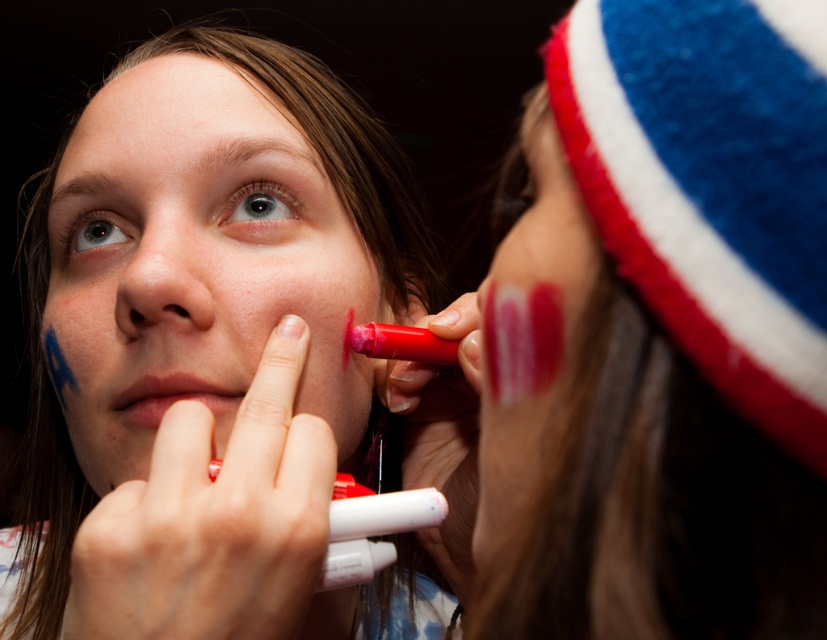
Question: Estimate the real-world distances between objects in this image. Which object is closer to the matte pink marker at lower left?

Choices:
 (A) matte pink paint at right
 (B) matte red marker at right

Answer: (B)

Question: From the image, what is the correct spatial relationship of matte red marker at right in relation to matte pink paint at right?

Choices:
 (A) left
 (B) right

Answer: (B)

Question: Can you confirm if matte red lipstick at lower right is smaller than matte pink lips at lower center?

Choices:
 (A) no
 (B) yes

Answer: (B)

Question: Does matte red marker at right appear on the right side of matte red lipstick at lower right?

Choices:
 (A) yes
 (B) no

Answer: (A)

Question: Which of the following is the farthest from the observer?

Choices:
 (A) matte red marker at right
 (B) matte skin nose at center
 (C) matte pink marker at lower left
 (D) matte pink paint at right

Answer: (C)

Question: Which of the following is the closest to the observer?

Choices:
 (A) (155, 307)
 (B) (144, 282)

Answer: (B)